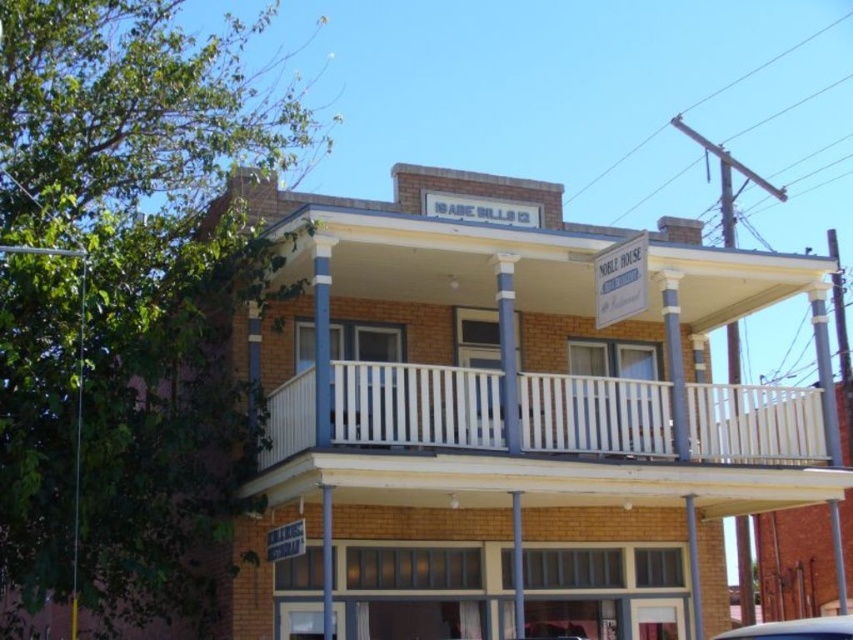
Question: From the image, what is the correct spatial relationship of white glossy car at lower right in relation to metallic silver sign at lower center?

Choices:
 (A) right
 (B) left

Answer: (A)

Question: Which of the following is the closest to the observer?

Choices:
 (A) metallic silver sign at lower center
 (B) white glossy car at lower right

Answer: (B)

Question: Does white glossy car at lower right have a smaller size compared to metallic silver sign at lower center?

Choices:
 (A) yes
 (B) no

Answer: (B)

Question: Can you confirm if white glossy car at lower right is positioned to the right of metallic silver sign at lower center?

Choices:
 (A) yes
 (B) no

Answer: (A)